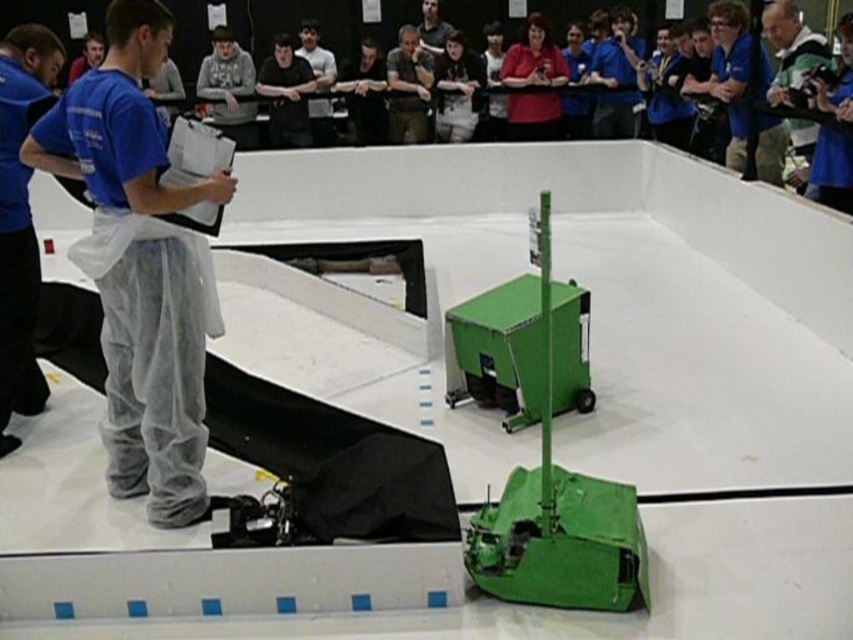
Question: From the image, what is the correct spatial relationship of black cotton shirt at center in relation to matte brown shirt at center?

Choices:
 (A) right
 (B) left

Answer: (B)

Question: Does gray sweatshirt at upper center have a greater width compared to black cotton shirt at center?

Choices:
 (A) no
 (B) yes

Answer: (B)

Question: Among these objects, which one is nearest to the camera?

Choices:
 (A) white fabric pants at left
 (B) green matte robot at center
 (C) gray sweatshirt at upper center
 (D) matte brown shirt at center

Answer: (B)

Question: Does matte red shirt at upper center appear under gray sweatshirt at upper center?

Choices:
 (A) yes
 (B) no

Answer: (B)

Question: Which of the following is the farthest from the observer?

Choices:
 (A) tap(579, 593)
 (B) tap(236, 74)
 (C) tap(268, 74)

Answer: (B)

Question: Which point appears farthest from the camera in this image?

Choices:
 (A) (485, 564)
 (B) (165, 161)

Answer: (B)